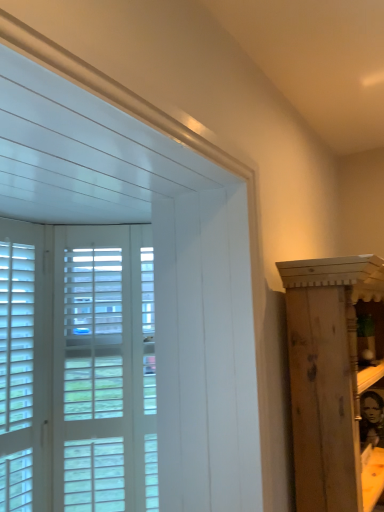
Question: From the image's perspective, is wooden cabinet at right on top of white wood window at left?

Choices:
 (A) yes
 (B) no

Answer: (B)

Question: Does wooden cabinet at right have a lesser height compared to white wood window at left?

Choices:
 (A) no
 (B) yes

Answer: (A)

Question: From the image's perspective, is wooden cabinet at right beneath white wood window at left?

Choices:
 (A) no
 (B) yes

Answer: (B)

Question: From a real-world perspective, does wooden cabinet at right stand above white wood window at left?

Choices:
 (A) yes
 (B) no

Answer: (B)

Question: Does wooden cabinet at right appear on the left side of white wood window at left?

Choices:
 (A) yes
 (B) no

Answer: (B)

Question: Does point (86, 396) appear closer or farther from the camera than point (6, 323)?

Choices:
 (A) farther
 (B) closer

Answer: (A)

Question: Considering the positions of white wood screen door at left and white wood window at left in the image, is white wood screen door at left wider or thinner than white wood window at left?

Choices:
 (A) thin
 (B) wide

Answer: (B)

Question: Considering their positions, is white wood screen door at left located in front of or behind white wood window at left?

Choices:
 (A) behind
 (B) front

Answer: (A)

Question: Looking at the image, does white wood screen door at left seem bigger or smaller compared to white wood window at left?

Choices:
 (A) big
 (B) small

Answer: (A)

Question: Considering the positions of white wood screen door at left and wooden cabinet at right in the image, is white wood screen door at left bigger or smaller than wooden cabinet at right?

Choices:
 (A) big
 (B) small

Answer: (B)

Question: Considering the positions of white wood screen door at left and wooden cabinet at right in the image, is white wood screen door at left taller or shorter than wooden cabinet at right?

Choices:
 (A) tall
 (B) short

Answer: (A)

Question: Is point (127, 307) closer or farther from the camera than point (365, 264)?

Choices:
 (A) farther
 (B) closer

Answer: (A)

Question: Is white wood screen door at left in front of or behind wooden cabinet at right in the image?

Choices:
 (A) front
 (B) behind

Answer: (B)

Question: Is wooden cabinet at right bigger or smaller than white wood window at left?

Choices:
 (A) big
 (B) small

Answer: (A)

Question: Is point (347, 364) positioned closer to the camera than point (26, 275)?

Choices:
 (A) farther
 (B) closer

Answer: (B)